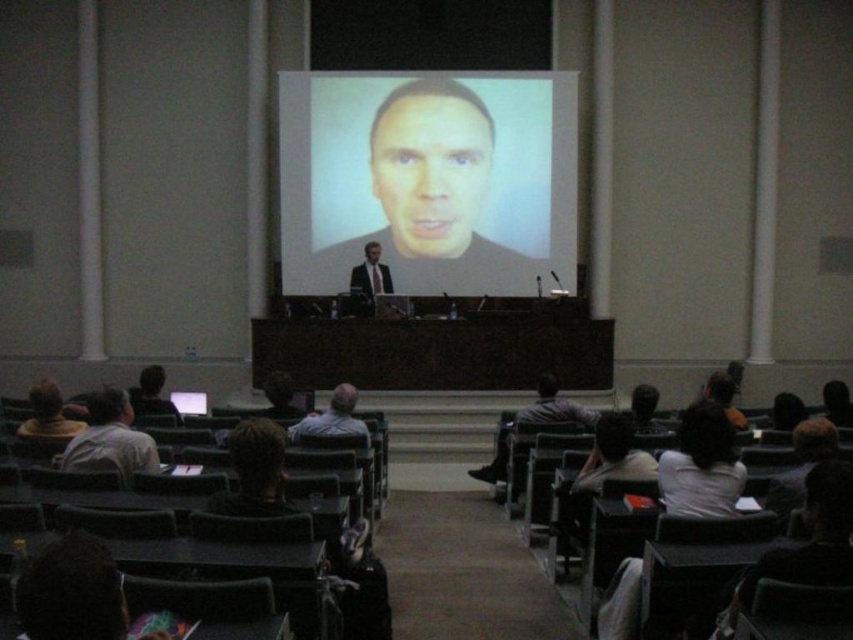
This screenshot has width=853, height=640. What do you see at coordinates (430, 170) in the screenshot?
I see `smooth skin face at center` at bounding box center [430, 170].

Can you confirm if smooth skin face at center is positioned to the right of matte black suit at center?

Correct, you'll find smooth skin face at center to the right of matte black suit at center.

What do you see at coordinates (430, 170) in the screenshot? I see `smooth skin face at center` at bounding box center [430, 170].

In order to click on smooth skin face at center in this screenshot , I will do `click(430, 170)`.

Identify the location of matte screen at center. (428, 179).

Can you confirm if matte screen at center is smaller than gray hair at center?

No, matte screen at center is not smaller than gray hair at center.

Is point (279, 221) closer to viewer compared to point (357, 396)?

No, (279, 221) is further to viewer.

Locate an element on the screen. The height and width of the screenshot is (640, 853). matte screen at center is located at coordinates (428, 179).

Who is shorter, dark brown hair at lower left or matte black face at center?

matte black face at center is shorter.

Can you confirm if dark brown hair at lower left is taller than matte black face at center?

Correct, dark brown hair at lower left is much taller as matte black face at center.

Describe the element at coordinates (151, 394) in the screenshot. I see `dark brown hair at lower left` at that location.

Identify the location of dark brown hair at lower left. The height and width of the screenshot is (640, 853). (151, 394).